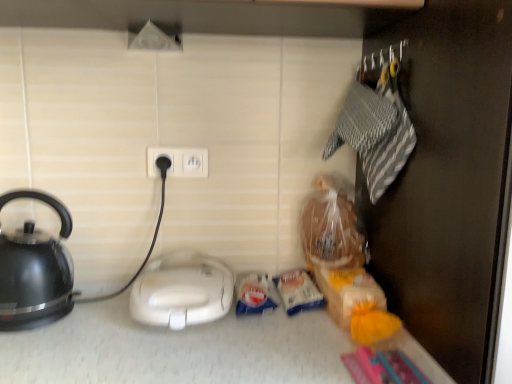
Describe the element at coordinates (33, 279) in the screenshot. I see `black glossy kettle at left` at that location.

You are a GUI agent. You are given a task and a screenshot of the screen. Output one action in this format:
    pyautogui.click(x=<x>, y=<y>)
    Task: Click on the white plastic socket at center
    
    Given the screenshot: What is the action you would take?
    pyautogui.click(x=179, y=162)

Which is more to the left, white plastic sandwich maker at center or black glossy kettle at left?

From the viewer's perspective, black glossy kettle at left appears more on the left side.

From a real-world perspective, which object stands above the other?

black glossy kettle at left is physically above.

Does white plastic sandwich maker at center touch black glossy kettle at left?

white plastic sandwich maker at center and black glossy kettle at left are clearly separated.

How different are the orientations of black glossy kettle at left and white plastic sandwich maker at center in degrees?

The angle between the facing direction of black glossy kettle at left and the facing direction of white plastic sandwich maker at center is 3.35e-05 degrees.

Image resolution: width=512 pixels, height=384 pixels. In order to click on appliance below the black glossy kettle at left (from a real-world perspective) in this screenshot , I will do `click(182, 290)`.

In the image, is black glossy kettle at left on the left side or the right side of white plastic sandwich maker at center?

Clearly, black glossy kettle at left is on the left of white plastic sandwich maker at center in the image.

From the picture: Looking at the image, does black glossy kettle at left seem bigger or smaller compared to white plastic sandwich maker at center?

black glossy kettle at left is bigger than white plastic sandwich maker at center.

Considering the sizes of objects black glossy kettle at left and white plastic socket at center in the image provided, who is bigger, black glossy kettle at left or white plastic socket at center?

black glossy kettle at left.

Is black glossy kettle at left further to the viewer compared to white plastic socket at center?

No, black glossy kettle at left is in front of white plastic socket at center.

Considering the positions of point (32, 244) and point (152, 162), is point (32, 244) closer or farther from the camera than point (152, 162)?

Point (32, 244) is closer to the camera than point (152, 162).

From the image's perspective, which one is positioned higher, white plastic sandwich maker at center or white plastic socket at center?

white plastic socket at center.

Is there a large distance between white plastic sandwich maker at center and white plastic socket at center?

No, white plastic sandwich maker at center is not far from white plastic socket at center.

Is white plastic socket at center located within white plastic sandwich maker at center?

No, white plastic socket at center is not a part of white plastic sandwich maker at center.

From a real-world perspective, is white plastic socket at center located higher than black glossy kettle at left?

Yes.

Is white plastic socket at center placed right next to black glossy kettle at left?

No, white plastic socket at center is not touching black glossy kettle at left.

How different are the orientations of white plastic socket at center and black glossy kettle at left in degrees?

white plastic socket at center and black glossy kettle at left are facing 1.35 degrees away from each other.

Locate an element on the screen. power plugs and sockets above the black glossy kettle at left (from a real-world perspective) is located at coordinates (179, 162).

Is white plastic socket at center thinner than white plastic sandwich maker at center?

Yes.

The image size is (512, 384). Identify the location of power plugs and sockets on the left of white plastic sandwich maker at center. tap(179, 162).

Does white plastic socket at center have a greater height compared to white plastic sandwich maker at center?

No, white plastic socket at center is not taller than white plastic sandwich maker at center.

Considering the relative sizes of white plastic socket at center and white plastic sandwich maker at center in the image provided, is white plastic socket at center smaller than white plastic sandwich maker at center?

Correct, white plastic socket at center occupies less space than white plastic sandwich maker at center.

In order to click on kettle that appears on the left of white plastic sandwich maker at center in this screenshot , I will do `click(33, 279)`.

Find the location of a particular element. This screenshot has height=384, width=512. appliance below the black glossy kettle at left (from a real-world perspective) is located at coordinates (182, 290).

When comparing their distances from black glossy kettle at left, does white plastic sandwich maker at center or white plastic socket at center seem closer?

Based on the image, white plastic sandwich maker at center appears to be nearer to black glossy kettle at left.

Looking at the image, which one is located closer to white plastic sandwich maker at center, white plastic socket at center or black glossy kettle at left?

black glossy kettle at left is positioned closer to the anchor white plastic sandwich maker at center.

When comparing their distances from white plastic sandwich maker at center, does black glossy kettle at left or white plastic socket at center seem closer?

black glossy kettle at left is closer to white plastic sandwich maker at center.

Considering their positions, is black glossy kettle at left positioned further to white plastic socket at center than white plastic sandwich maker at center?

Based on the image, black glossy kettle at left appears to be further to white plastic socket at center.

Consider the image. From the image, which object appears to be farther from white plastic socket at center, white plastic sandwich maker at center or black glossy kettle at left?

The object further to white plastic socket at center is black glossy kettle at left.

Estimate the real-world distances between objects in this image. Which object is further from black glossy kettle at left, white plastic socket at center or white plastic sandwich maker at center?

white plastic socket at center is further to black glossy kettle at left.

Identify the location of power plugs and sockets between black glossy kettle at left and white plastic sandwich maker at center in the horizontal direction. (179, 162).